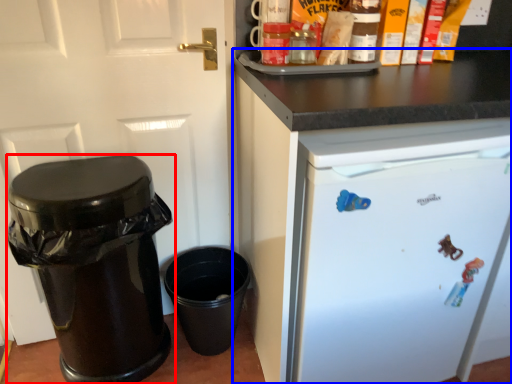
Question: Which object appears closest to the camera in this image, waste container (highlighted by a red box) or cabinetry (highlighted by a blue box)?

Choices:
 (A) waste container
 (B) cabinetry

Answer: (B)